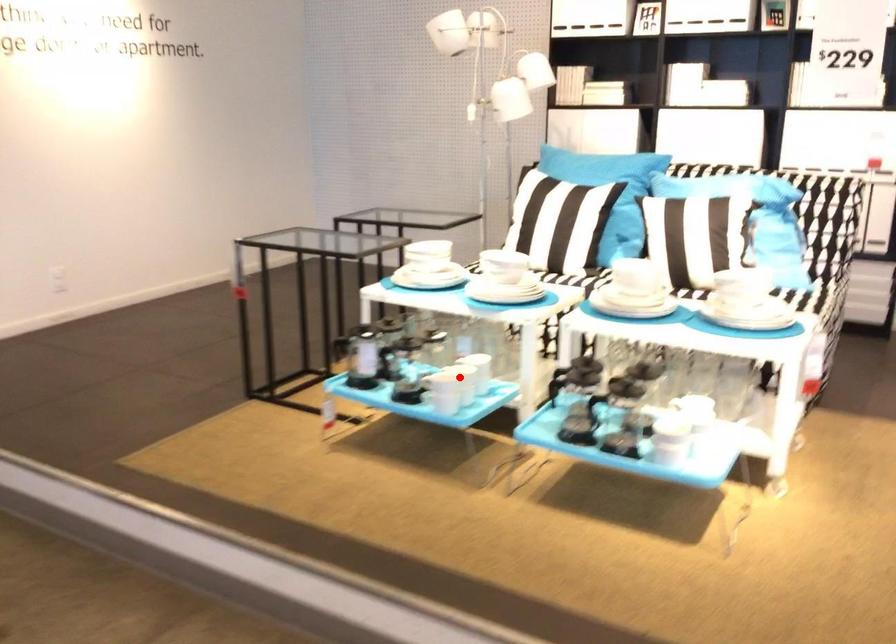
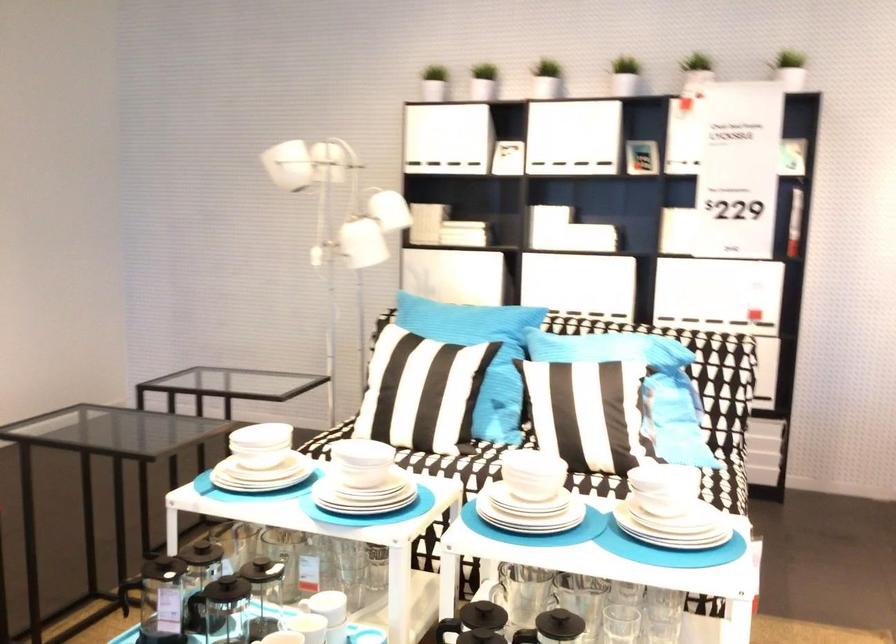
Question: I am providing you with two images of the same scene from different viewpoints. In image1, a red point is highlighted. Considering the same 3D point in image2, which of the following is correct?

Choices:
 (A) It is closer
 (B) It is farther

Answer: (A)